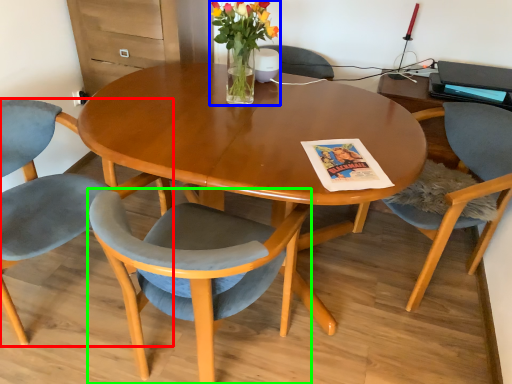
Question: Which object is the farthest from chair (highlighted by a red box)? Choose among these: floral arrangement (highlighted by a blue box) or chair (highlighted by a green box).

Choices:
 (A) floral arrangement
 (B) chair

Answer: (A)